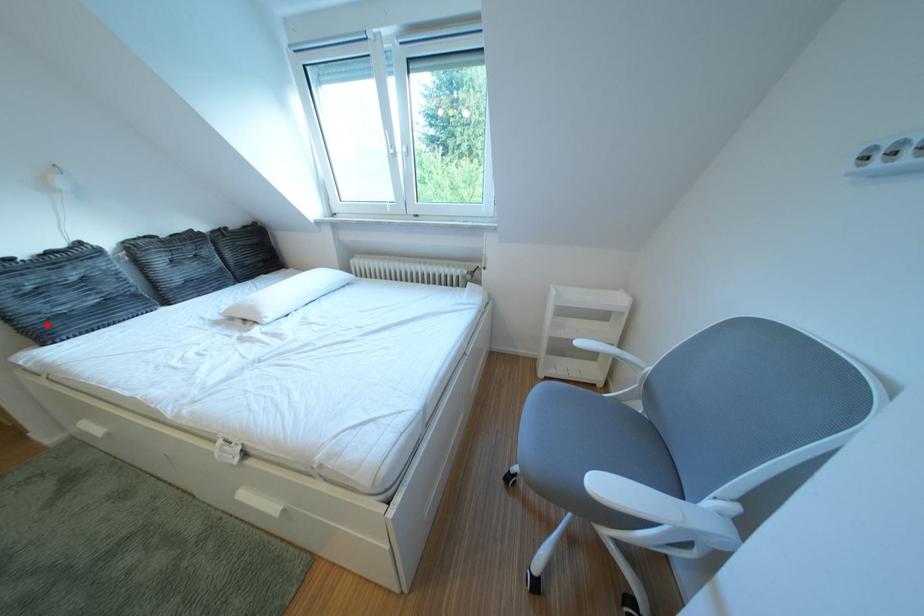
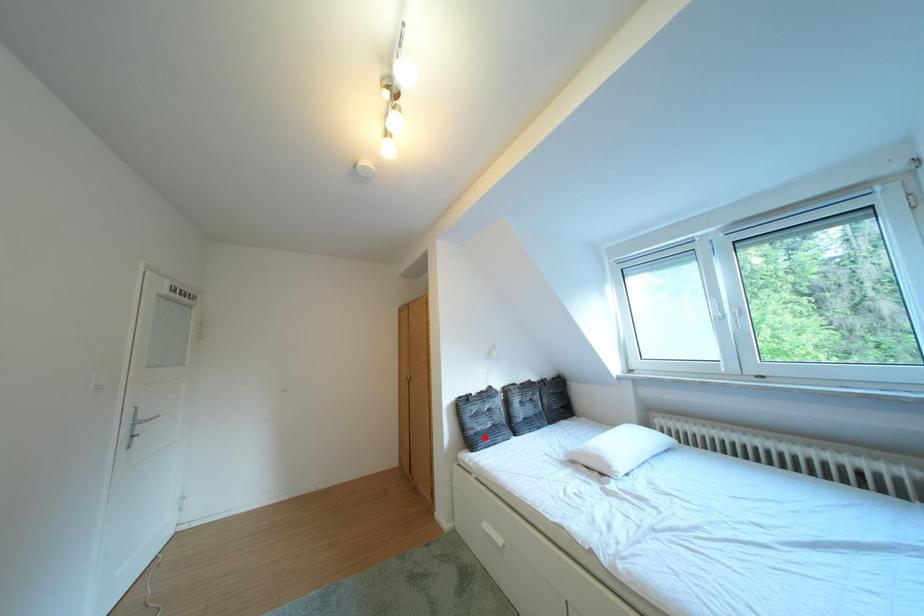
Based on the photo, I am providing you with two images of the same scene from different viewpoints. A red point is marked on the first image and another point is marked on the second image. Is the red point in image1 aligned with the point shown in image2?

Yes